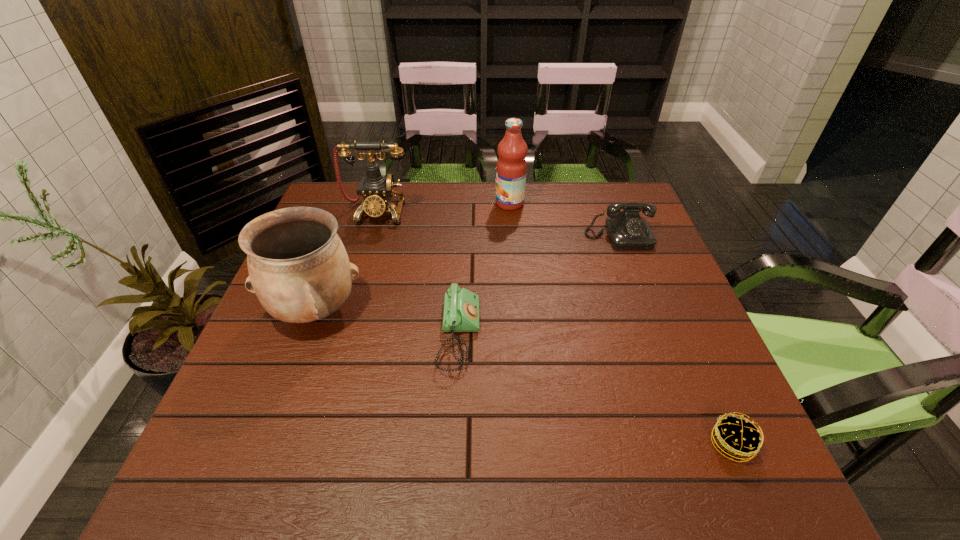
Locate an element on the screen. The width and height of the screenshot is (960, 540). fruit juice is located at coordinates (511, 169).

I want to click on urn, so click(299, 269).

Locate an element on the screen. The width and height of the screenshot is (960, 540). the tallest telephone is located at coordinates (376, 190).

Locate an element on the screen. Image resolution: width=960 pixels, height=540 pixels. the rightmost telephone is located at coordinates (627, 230).

The height and width of the screenshot is (540, 960). I want to click on the third shortest object, so click(x=627, y=230).

This screenshot has height=540, width=960. I want to click on the third object from left to right, so click(461, 307).

You are a GUI agent. You are given a task and a screenshot of the screen. Output one action in this format:
    pyautogui.click(x=<x>, y=<y>)
    Task: Click on the shortest telephone
    The height and width of the screenshot is (540, 960).
    Given the screenshot: What is the action you would take?
    pyautogui.click(x=461, y=307)

Image resolution: width=960 pixels, height=540 pixels. I want to click on the nearest object, so click(x=738, y=438).

This screenshot has width=960, height=540. In order to click on free space located on the front label of the fourth object from left to right in this screenshot , I will do `click(375, 204)`.

You are a GUI agent. You are given a task and a screenshot of the screen. Output one action in this format:
    pyautogui.click(x=<x>, y=<y>)
    Task: Click on the vacant space located 0.210m on the front label of the fourth object from left to right
    The width and height of the screenshot is (960, 540).
    Given the screenshot: What is the action you would take?
    pyautogui.click(x=429, y=204)